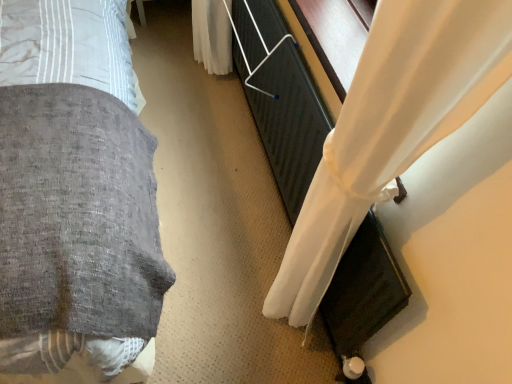
Where is `vacant space in between textured gray blanket at left and white sheer curtain at right`? The width and height of the screenshot is (512, 384). vacant space in between textured gray blanket at left and white sheer curtain at right is located at coordinates (246, 236).